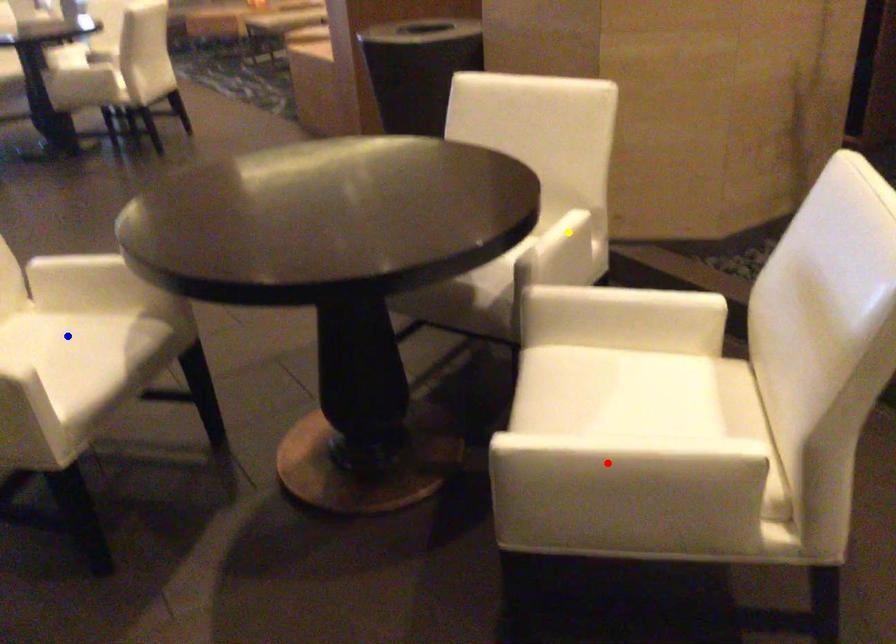
Order these from nearest to farthest:
- red point
- yellow point
- blue point

red point → blue point → yellow point